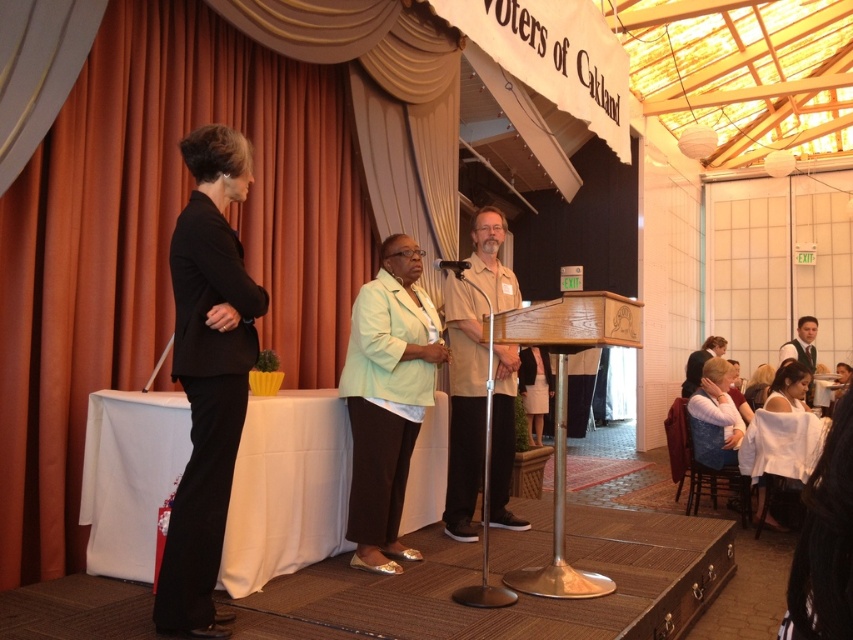
You are attending the event and want to locate the mint green fabric jacket at center. According to the coordinates provided, where exactly would you find it?

The mint green fabric jacket at center is located at point 0.625 on the x axis and 0.455 on the y axis.

You are an event organizer who needs to ensure all participants have enough space on the stage. The mint green fabric jacket at center and the beige fabric shirt at center are both part of the participants. Based on their positions and the stage layout, which participant requires more horizontal space due to their clothing?

The mint green fabric jacket at center requires more horizontal space because its width surpasses that of the beige fabric shirt at center.